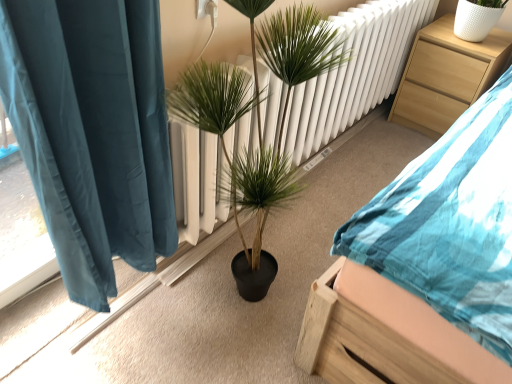
Question: Is green leafy plant at center next to light wood nightstand at upper right and touching it?

Choices:
 (A) yes
 (B) no

Answer: (B)

Question: Is green leafy plant at center far from light wood nightstand at upper right?

Choices:
 (A) no
 (B) yes

Answer: (B)

Question: Considering the relative positions of green leafy plant at center and light wood nightstand at upper right in the image provided, is green leafy plant at center in front of light wood nightstand at upper right?

Choices:
 (A) yes
 (B) no

Answer: (A)

Question: Considering the relative sizes of green leafy plant at center and light wood nightstand at upper right in the image provided, is green leafy plant at center shorter than light wood nightstand at upper right?

Choices:
 (A) yes
 (B) no

Answer: (B)

Question: From a real-world perspective, does green leafy plant at center sit lower than light wood nightstand at upper right?

Choices:
 (A) no
 (B) yes

Answer: (A)

Question: From the image's perspective, relative to light wood nightstand at upper right, is green leafy plant at center above or below?

Choices:
 (A) below
 (B) above

Answer: (A)

Question: Looking at their shapes, would you say green leafy plant at center is wider or thinner than light wood nightstand at upper right?

Choices:
 (A) wide
 (B) thin

Answer: (B)

Question: Is green leafy plant at center in front of or behind light wood nightstand at upper right in the image?

Choices:
 (A) front
 (B) behind

Answer: (A)

Question: In terms of height, does green leafy plant at center look taller or shorter compared to light wood nightstand at upper right?

Choices:
 (A) short
 (B) tall

Answer: (B)

Question: Choose the correct answer: Is green leafy plant at center inside wooden bed at center or outside it?

Choices:
 (A) outside
 (B) inside

Answer: (A)

Question: Relative to wooden bed at center, is green leafy plant at center in front or behind?

Choices:
 (A) behind
 (B) front

Answer: (A)

Question: In terms of size, does green leafy plant at center appear bigger or smaller than wooden bed at center?

Choices:
 (A) small
 (B) big

Answer: (A)

Question: Is green leafy plant at center wider or thinner than wooden bed at center?

Choices:
 (A) wide
 (B) thin

Answer: (B)

Question: Is wooden bed at center in front of or behind light wood nightstand at upper right in the image?

Choices:
 (A) behind
 (B) front

Answer: (B)

Question: In terms of width, does wooden bed at center look wider or thinner when compared to light wood nightstand at upper right?

Choices:
 (A) wide
 (B) thin

Answer: (A)